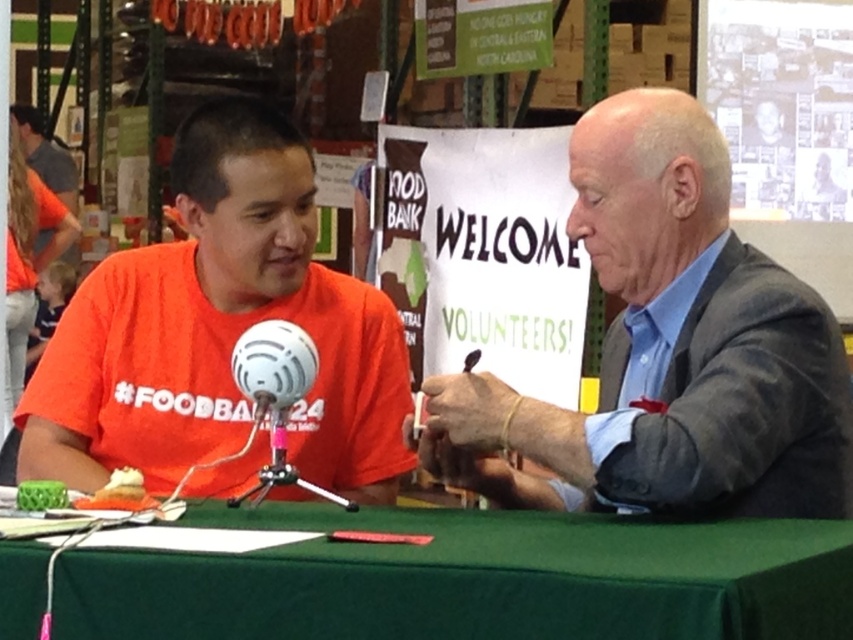
Question: Which object is closer to the camera taking this photo?

Choices:
 (A) gray suit jacket at right
 (B) orange t-shirt at left

Answer: (A)

Question: Which point is closer to the camera?

Choices:
 (A) (679, 577)
 (B) (567, 497)

Answer: (A)

Question: Is gray suit jacket at right positioned before green fabric table at center?

Choices:
 (A) no
 (B) yes

Answer: (A)

Question: Which object is the farthest from the gray suit jacket at right?

Choices:
 (A) orange t-shirt at left
 (B) green fabric table at center

Answer: (A)

Question: Is gray suit jacket at right thinner than green fabric table at center?

Choices:
 (A) yes
 (B) no

Answer: (A)

Question: Is green fabric table at center further to camera compared to orange t-shirt at left?

Choices:
 (A) no
 (B) yes

Answer: (A)